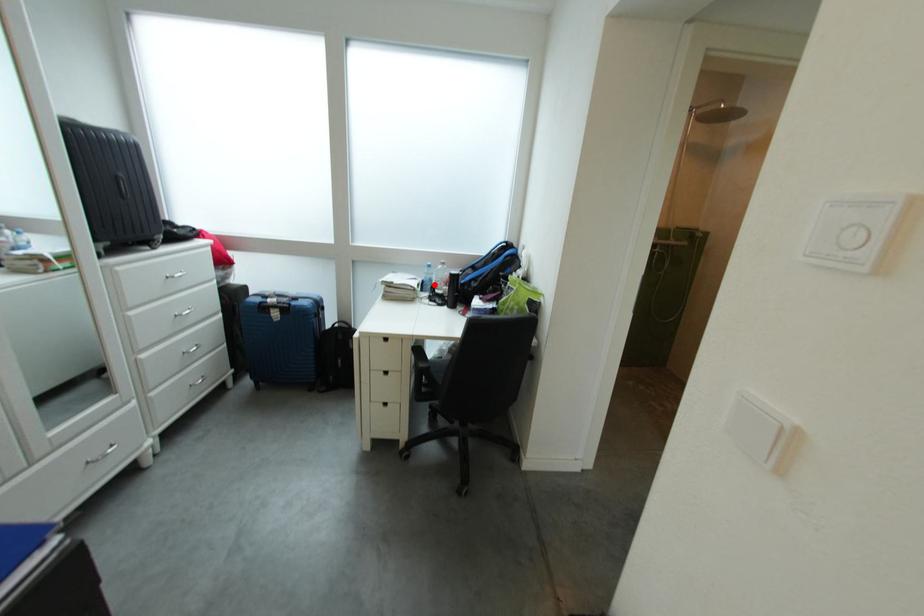
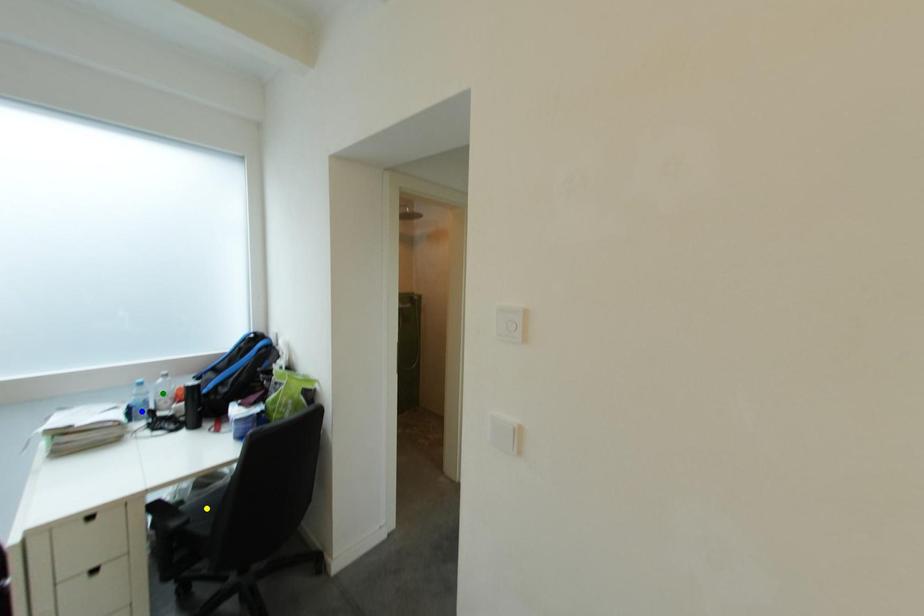
Question: I am providing you with two images of the same scene from different viewpoints. A red point is marked on the first image. You are given multiple points on the second image. In image 2, which mark is for the same physical point as the one in image 1?

Choices:
 (A) green point
 (B) yellow point
 (C) blue point

Answer: (C)